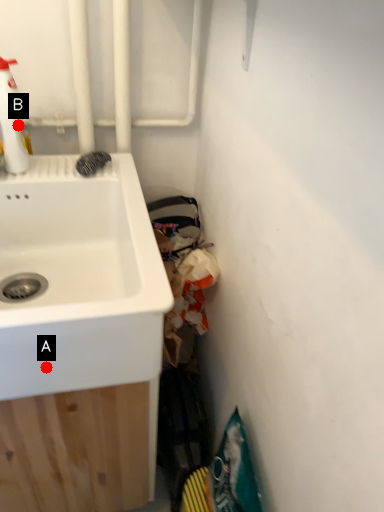
Question: Two points are circled on the image, labeled by A and B beside each circle. Which of the following is the closest to the observer?

Choices:
 (A) A is closer
 (B) B is closer

Answer: (A)